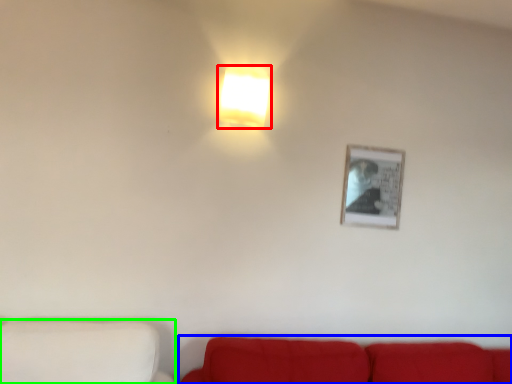
Question: Estimate the real-world distances between objects in this image. Which object is closer to lamp (highlighted by a red box), studio couch (highlighted by a blue box) or furniture (highlighted by a green box)?

Choices:
 (A) studio couch
 (B) furniture

Answer: (B)